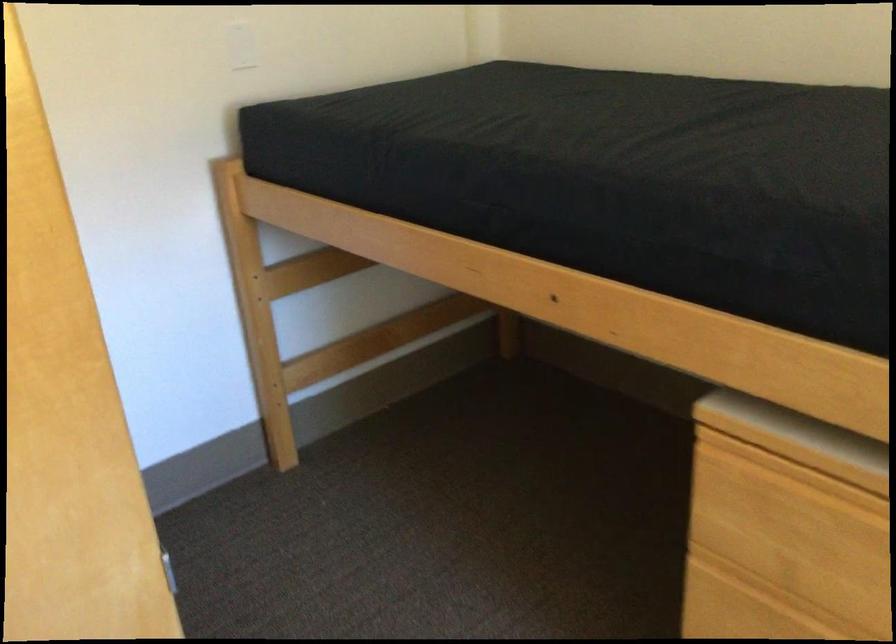
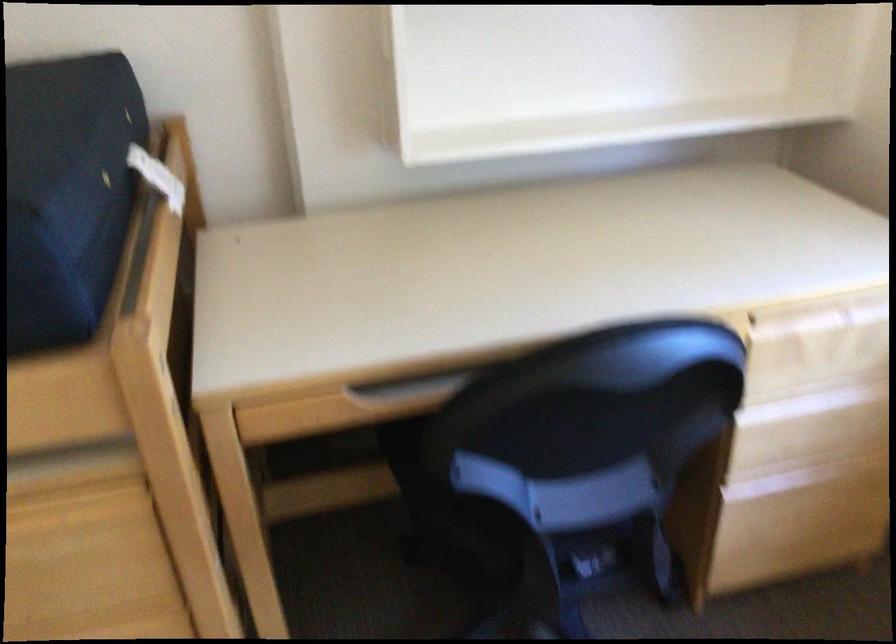
Question: The first image is from the beginning of the video and the second image is from the end. How did the camera likely rotate when shooting the video?

Choices:
 (A) Left
 (B) Right
 (C) Up
 (D) Down

Answer: (B)